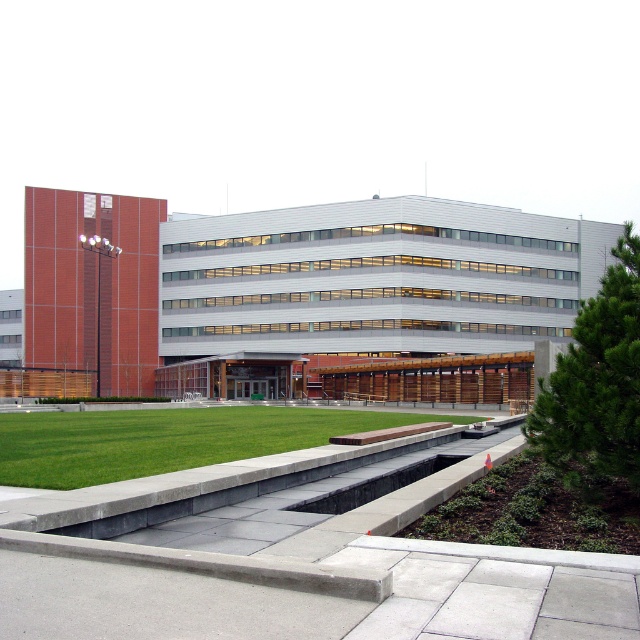
Question: Estimate the real-world distances between objects in this image. Which object is farther from the green grass at lower center?

Choices:
 (A) matte brick building at left
 (B) gray concrete pavement at lower center

Answer: (A)

Question: Among these points, which one is farthest from the camera?

Choices:
 (A) (35, 483)
 (B) (566, 332)
 (C) (433, 545)

Answer: (B)

Question: Which is farther from the green grass at lower center?

Choices:
 (A) matte brick building at left
 (B) gray concrete pavement at lower center

Answer: (A)

Question: Is matte brick building at left to the left of gray concrete pavement at lower center from the viewer's perspective?

Choices:
 (A) no
 (B) yes

Answer: (A)

Question: Is matte brick building at left thinner than gray concrete pavement at lower center?

Choices:
 (A) yes
 (B) no

Answer: (B)

Question: Can you confirm if matte brick building at left is smaller than gray concrete pavement at lower center?

Choices:
 (A) no
 (B) yes

Answer: (A)